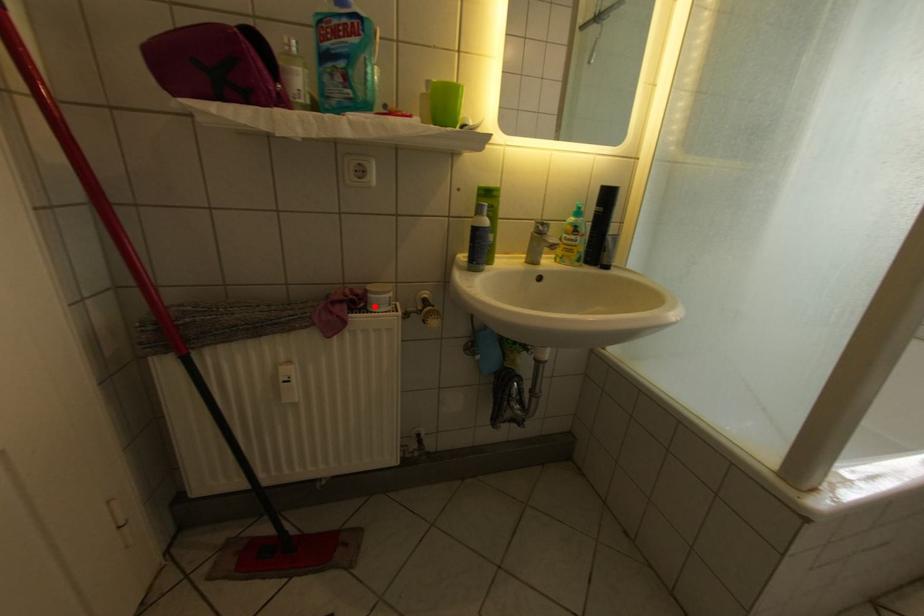
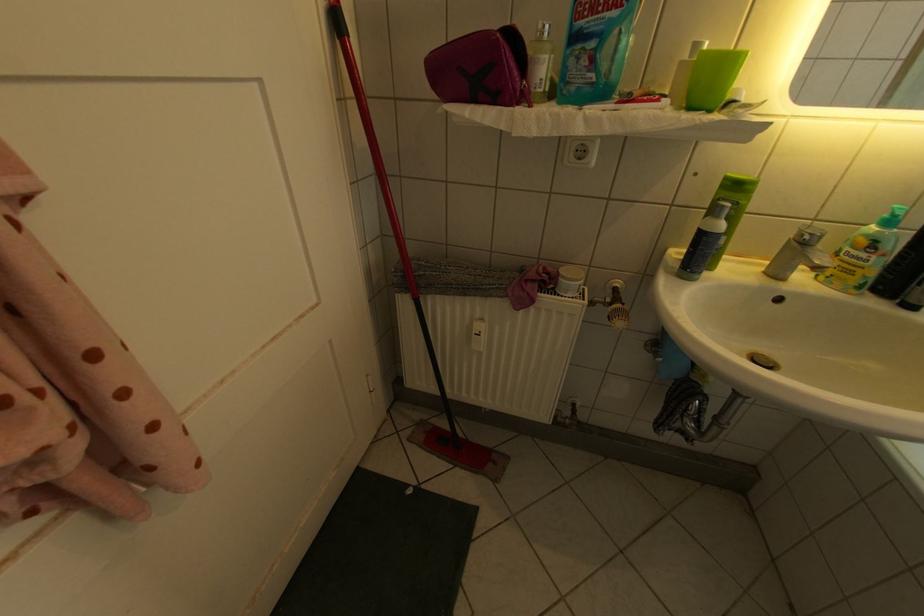
Locate, in the second image, the point that corresponds to the highlighted location in the first image.

(564, 286)